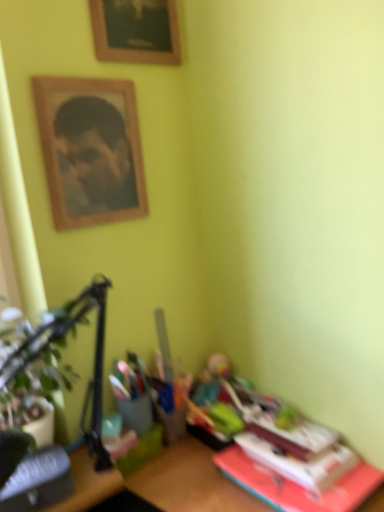
The image size is (384, 512). I want to click on blank space situated above hardcover book at lower right, the first paperback book in the right-to-left sequence (from a real-world perspective), so click(x=288, y=439).